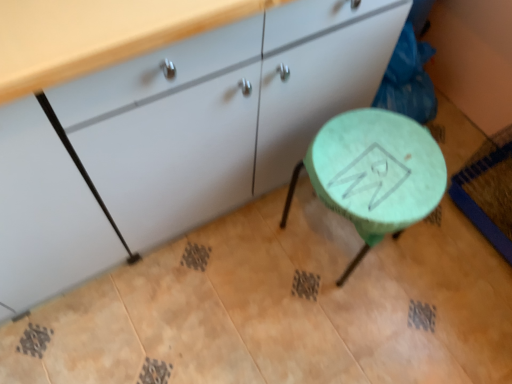
Question: Is green matte stool at center taller than matte white cabinet at center?

Choices:
 (A) yes
 (B) no

Answer: (B)

Question: Considering the relative sizes of green matte stool at center and matte white cabinet at center in the image provided, is green matte stool at center bigger than matte white cabinet at center?

Choices:
 (A) no
 (B) yes

Answer: (A)

Question: Can you confirm if green matte stool at center is smaller than matte white cabinet at center?

Choices:
 (A) yes
 (B) no

Answer: (A)

Question: From a real-world perspective, is green matte stool at center over matte white cabinet at center?

Choices:
 (A) yes
 (B) no

Answer: (B)

Question: Is green matte stool at center positioned with its back to matte white cabinet at center?

Choices:
 (A) no
 (B) yes

Answer: (B)

Question: Is green matte stool at center not near matte white cabinet at center?

Choices:
 (A) yes
 (B) no

Answer: (B)

Question: From the image's perspective, does matte white cabinet at center appear lower than green matte stool at center?

Choices:
 (A) yes
 (B) no

Answer: (B)

Question: Can you confirm if matte white cabinet at center is wider than green matte stool at center?

Choices:
 (A) yes
 (B) no

Answer: (A)

Question: From a real-world perspective, is matte white cabinet at center below green matte stool at center?

Choices:
 (A) no
 (B) yes

Answer: (A)

Question: Does matte white cabinet at center have a lesser width compared to green matte stool at center?

Choices:
 (A) yes
 (B) no

Answer: (B)

Question: Are matte white cabinet at center and green matte stool at center making contact?

Choices:
 (A) yes
 (B) no

Answer: (B)

Question: Is matte white cabinet at center closer to camera compared to green matte stool at center?

Choices:
 (A) no
 (B) yes

Answer: (B)

Question: Looking at their shapes, would you say green matte stool at center is wider or thinner than matte white cabinet at center?

Choices:
 (A) thin
 (B) wide

Answer: (A)